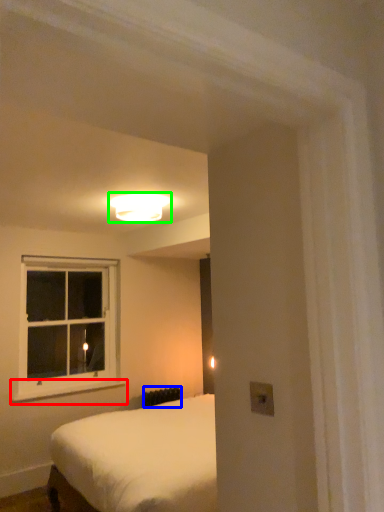
Question: Based on their relative distances, which object is nearer to window sill (highlighted by a red box)? Choose from radiator (highlighted by a blue box) and lamp (highlighted by a green box).

Choices:
 (A) radiator
 (B) lamp

Answer: (A)